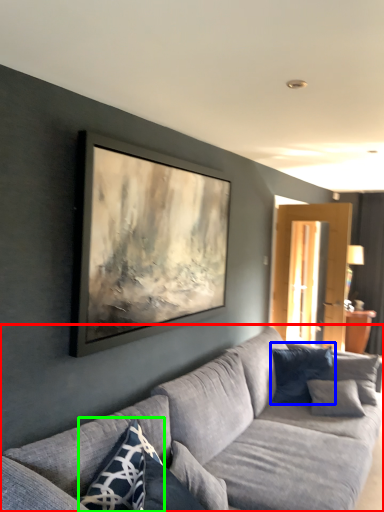
Question: Which is farther away from studio couch (highlighted by a red box)? pillow (highlighted by a blue box) or pillow (highlighted by a green box)?

Choices:
 (A) pillow
 (B) pillow

Answer: (A)